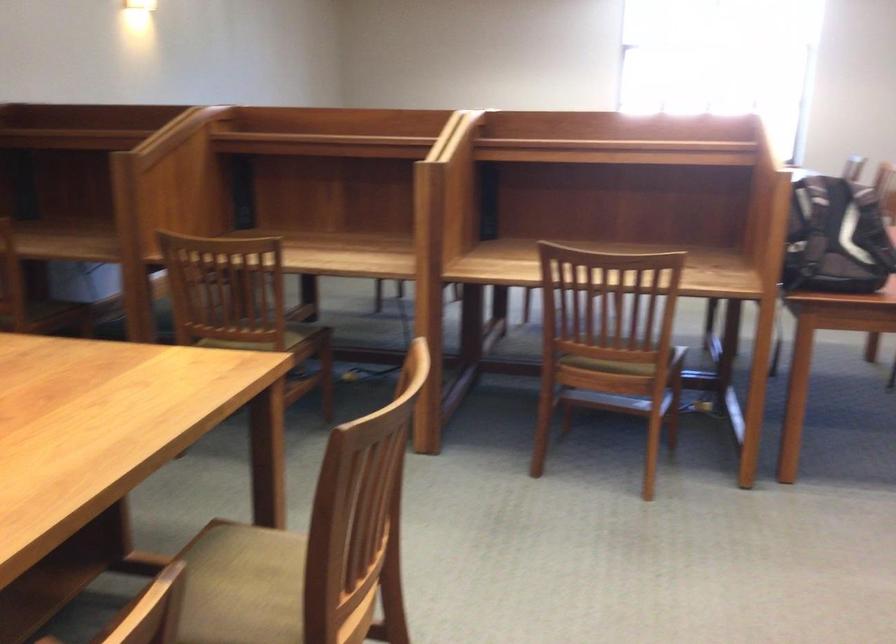
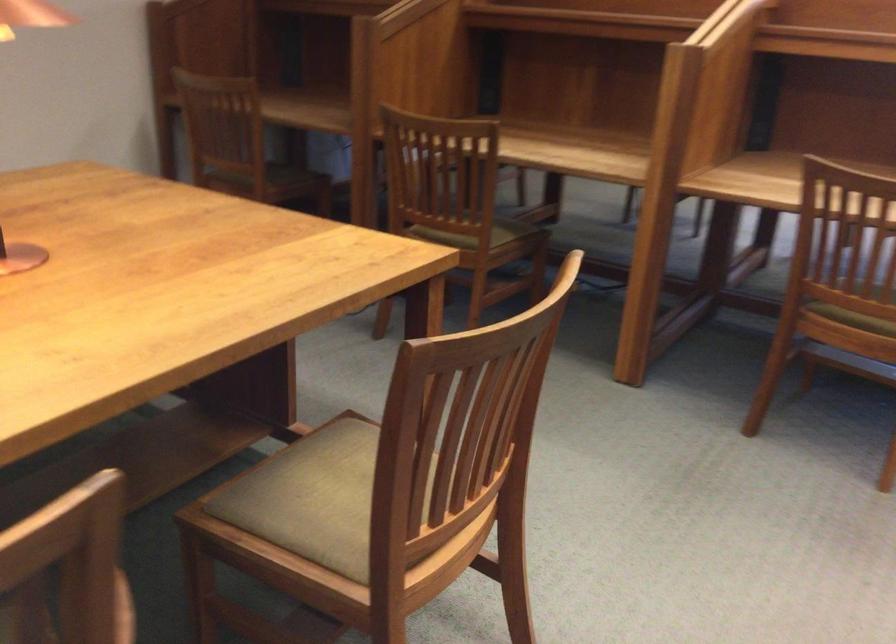
Find the pixel in the second image that matches pixel 265 344 in the first image.

(474, 234)